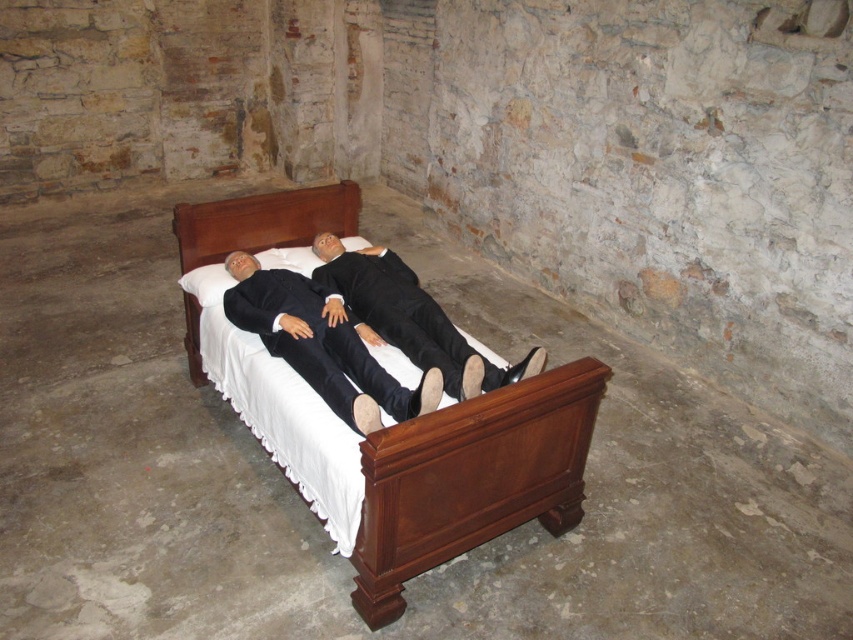
Question: Is black matte suit at center bigger than brown wood headboard at center?

Choices:
 (A) no
 (B) yes

Answer: (B)

Question: Considering the real-world distances, which object is farthest from the black matte business suit at center?

Choices:
 (A) mahogany wood bed at center
 (B) black matte suit at center

Answer: (A)

Question: Does black matte business suit at center lie in front of brown wood headboard at center?

Choices:
 (A) no
 (B) yes

Answer: (B)

Question: Which object is the closest to the black matte business suit at center?

Choices:
 (A) brown wood headboard at center
 (B) mahogany wood bed at center

Answer: (A)

Question: Which point is closer to the camera taking this photo?

Choices:
 (A) (339, 184)
 (B) (373, 396)

Answer: (B)

Question: Considering the relative positions of black matte business suit at center and brown wood headboard at center in the image provided, where is black matte business suit at center located with respect to brown wood headboard at center?

Choices:
 (A) left
 (B) right

Answer: (B)